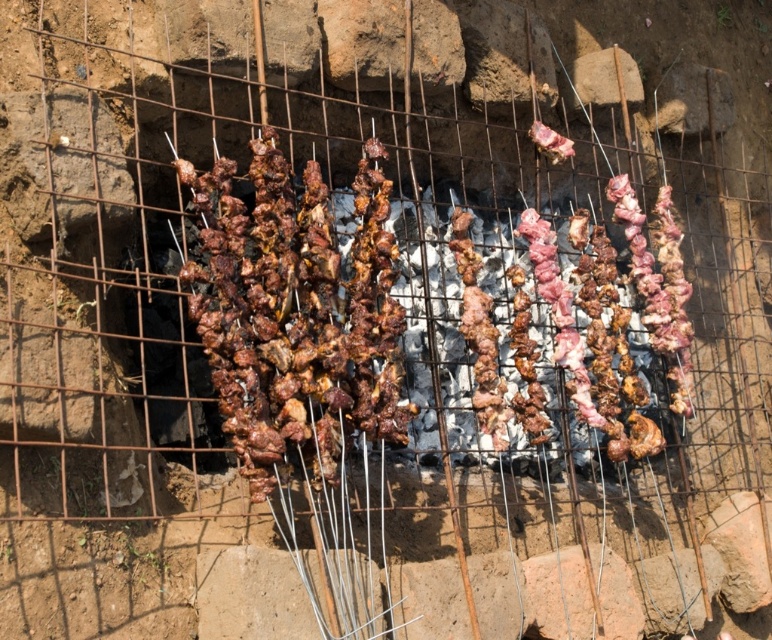
Question: Which of the following is the farthest from the observer?

Choices:
 (A) brown charred meat at center
 (B) brown charred skewers at center

Answer: (B)

Question: Does brown charred meat at center appear on the right side of pink raw meat at center?

Choices:
 (A) no
 (B) yes

Answer: (A)

Question: Which object is closer to the camera taking this photo?

Choices:
 (A) brown charred meat at center
 (B) pink raw meat at center
 (C) brown charred skewers at center

Answer: (A)

Question: Which point is farther from the camera taking this photo?

Choices:
 (A) (560, 156)
 (B) (330, 324)
 (C) (491, 432)

Answer: (A)

Question: Is brown charred meat at center wider than pink raw meat at center?

Choices:
 (A) no
 (B) yes

Answer: (B)

Question: Observing the image, what is the correct spatial positioning of brown charred skewers at center in reference to brown charred meat at center?

Choices:
 (A) left
 (B) right

Answer: (B)